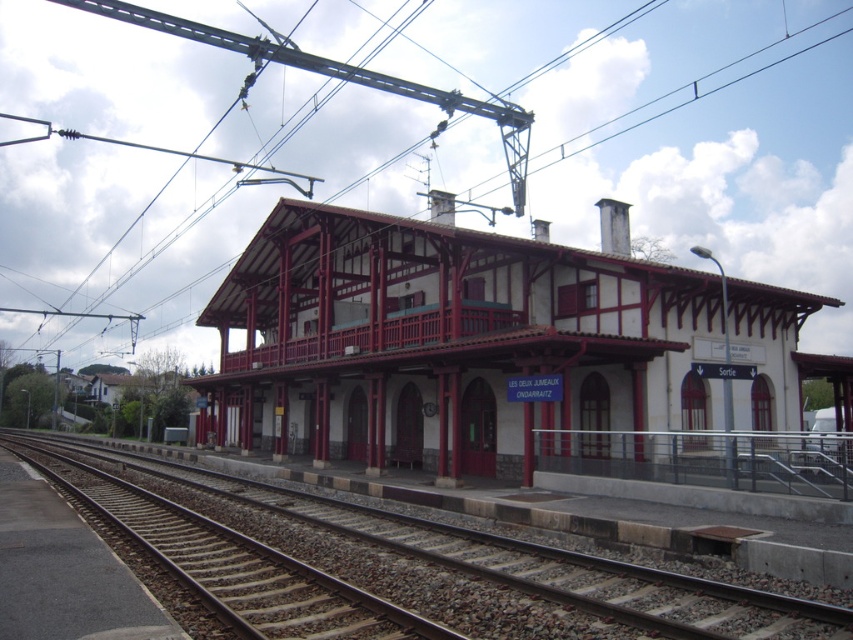
Who is positioned more to the left, white wood railway station at center or black metal railing at lower right?

Positioned to the left is white wood railway station at center.

Who is more forward, (294, 276) or (720, 448)?

Point (720, 448) is in front.

Locate an element on the screen. The image size is (853, 640). white wood railway station at center is located at coordinates (479, 346).

Can you confirm if smooth gravel track at center is positioned to the right of black metal railing at lower right?

Incorrect, smooth gravel track at center is not on the right side of black metal railing at lower right.

Find the location of a particular element. smooth gravel track at center is located at coordinates (498, 556).

Which of these two, white wood railway station at center or smooth gravel track at center, stands shorter?

With less height is smooth gravel track at center.

Who is more distant from viewer, (582, 413) or (686, 608)?

The point (582, 413) is behind.

At what (x,y) coordinates should I click in order to perform the action: click on white wood railway station at center. Please return your answer as a coordinate pair (x, y). The image size is (853, 640). Looking at the image, I should click on (479, 346).